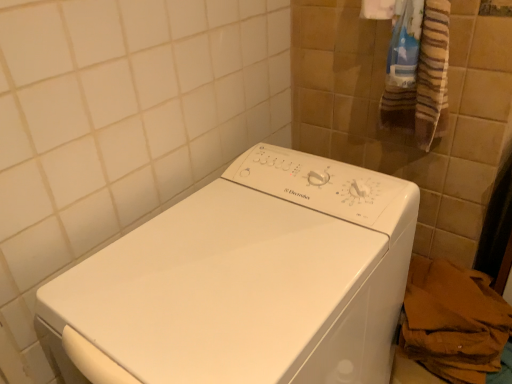
Question: Is striped cotton bath towel at upper right taller than white glossy washing machine at center?

Choices:
 (A) no
 (B) yes

Answer: (A)

Question: Considering the relative sizes of striped cotton bath towel at upper right and white glossy washing machine at center in the image provided, is striped cotton bath towel at upper right wider than white glossy washing machine at center?

Choices:
 (A) yes
 (B) no

Answer: (B)

Question: Is striped cotton bath towel at upper right shorter than white glossy washing machine at center?

Choices:
 (A) yes
 (B) no

Answer: (A)

Question: From a real-world perspective, is striped cotton bath towel at upper right located beneath white glossy washing machine at center?

Choices:
 (A) yes
 (B) no

Answer: (B)

Question: Is striped cotton bath towel at upper right positioned in front of white glossy washing machine at center?

Choices:
 (A) yes
 (B) no

Answer: (B)

Question: Is white glossy washing machine at center at the back of striped cotton bath towel at upper right?

Choices:
 (A) no
 (B) yes

Answer: (A)

Question: Is brown paper bag at lower right looking in the opposite direction of striped cotton bath towel at upper right?

Choices:
 (A) no
 (B) yes

Answer: (A)

Question: From a real-world perspective, is brown paper bag at lower right positioned over striped cotton bath towel at upper right based on gravity?

Choices:
 (A) no
 (B) yes

Answer: (A)

Question: Can you confirm if brown paper bag at lower right is taller than striped cotton bath towel at upper right?

Choices:
 (A) no
 (B) yes

Answer: (B)

Question: Does brown paper bag at lower right lie behind striped cotton bath towel at upper right?

Choices:
 (A) no
 (B) yes

Answer: (B)

Question: Can you confirm if brown paper bag at lower right is wider than striped cotton bath towel at upper right?

Choices:
 (A) no
 (B) yes

Answer: (B)

Question: Does brown paper bag at lower right appear on the left side of striped cotton bath towel at upper right?

Choices:
 (A) no
 (B) yes

Answer: (A)

Question: Can brown paper bag at lower right be found inside white glossy washing machine at center?

Choices:
 (A) yes
 (B) no

Answer: (B)